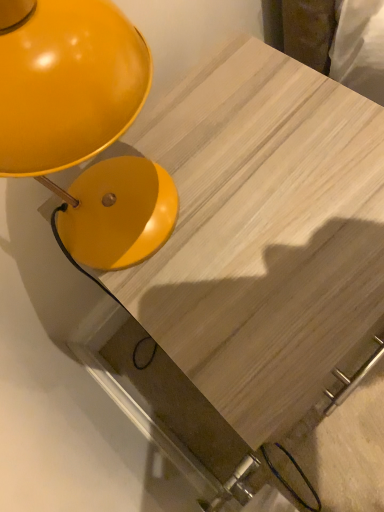
Identify the location of vacant area that is in front of glossy yellow lamp at upper left. This screenshot has height=512, width=384. point(232,290).